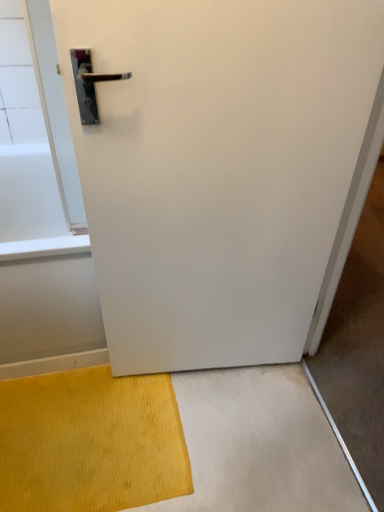
The width and height of the screenshot is (384, 512). I want to click on vacant area that lies to the right of yellow textured mat at lower left, so click(244, 432).